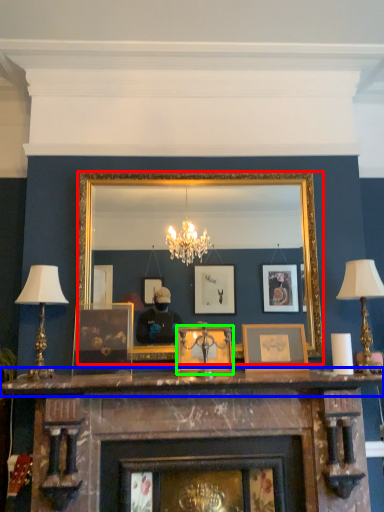
Question: Which is nearer to the mirror (highlighted by a red box)? mantle (highlighted by a blue box) or picture frame (highlighted by a green box).

Choices:
 (A) mantle
 (B) picture frame

Answer: (B)